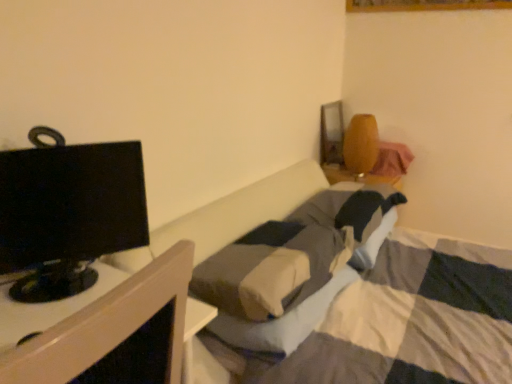
You are a GUI agent. You are given a task and a screenshot of the screen. Output one action in this format:
    pyautogui.click(x=<x>, y=<y>)
    Task: Click on the free spot in front of black glossy monitor at left
    The width and height of the screenshot is (512, 384).
    Given the screenshot: What is the action you would take?
    pyautogui.click(x=49, y=311)